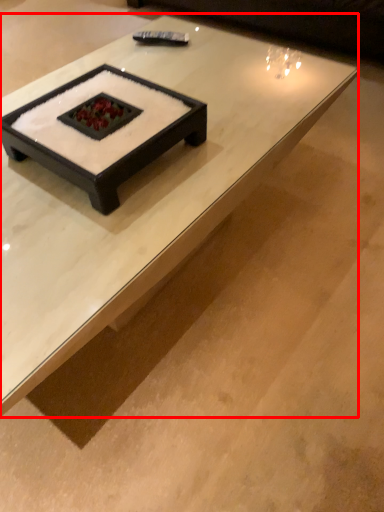
Question: Considering the relative positions of coffee table (annotated by the red box) and couch in the image provided, where is coffee table (annotated by the red box) located with respect to the staircase?

Choices:
 (A) left
 (B) right

Answer: (A)